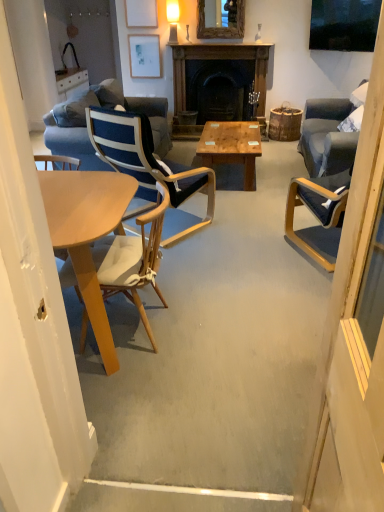
Question: Is woodenmaterial/texturecoffee table at center facing towards wooden fireplace at center?

Choices:
 (A) yes
 (B) no

Answer: (B)

Question: Is woodenmaterial/texturecoffee table at center at the right side of wooden fireplace at center?

Choices:
 (A) no
 (B) yes

Answer: (B)

Question: From the image's perspective, is woodenmaterial/texturecoffee table at center over wooden fireplace at center?

Choices:
 (A) no
 (B) yes

Answer: (A)

Question: Can you confirm if woodenmaterial/texturecoffee table at center is bigger than wooden fireplace at center?

Choices:
 (A) no
 (B) yes

Answer: (A)

Question: Is woodenmaterial/texturecoffee table at center located outside wooden fireplace at center?

Choices:
 (A) yes
 (B) no

Answer: (A)

Question: From a real-world perspective, is matte white picture frame at upper center, positioned as the 2th picture frame in back-to-front order, positioned above or below matte white picture frame at upper center, which ranks as the 1th picture frame in bottom-to-top order?

Choices:
 (A) below
 (B) above

Answer: (B)

Question: Is matte white picture frame at upper center, placed as the 1th picture frame when sorted from top to bottom, bigger or smaller than matte white picture frame at upper center, the 1th picture frame positioned from the back?

Choices:
 (A) big
 (B) small

Answer: (B)

Question: In the image, is matte white picture frame at upper center, placed as the 1th picture frame when sorted from top to bottom, positioned in front of or behind matte white picture frame at upper center, the 1th picture frame positioned from the back?

Choices:
 (A) front
 (B) behind

Answer: (A)

Question: Is point click(152, 10) positioned closer to the camera than point click(152, 64)?

Choices:
 (A) closer
 (B) farther

Answer: (A)

Question: Considering the positions of matte blue chair at right and blue fabric chair at center, the first chair viewed from the back, in the image, is matte blue chair at right bigger or smaller than blue fabric chair at center, the first chair viewed from the back,?

Choices:
 (A) small
 (B) big

Answer: (A)

Question: Considering the positions of point (364, 280) and point (127, 135), is point (364, 280) closer or farther from the camera than point (127, 135)?

Choices:
 (A) farther
 (B) closer

Answer: (B)

Question: From the image's perspective, is matte blue chair at right above or below blue fabric chair at center, placed as the 2th chair when sorted from front to back?

Choices:
 (A) below
 (B) above

Answer: (A)

Question: From a real-world perspective, relative to blue fabric chair at center, the first chair viewed from the back, is matte blue chair at right vertically above or below?

Choices:
 (A) below
 (B) above

Answer: (B)

Question: Do you think matte white lampshade at upper center is within matte blue chair at right, or outside of it?

Choices:
 (A) inside
 (B) outside

Answer: (B)

Question: Considering their positions, is matte white lampshade at upper center located in front of or behind matte blue chair at right?

Choices:
 (A) front
 (B) behind

Answer: (B)